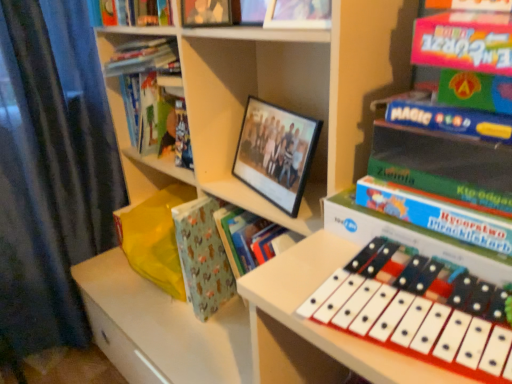
Question: Considering the relative sizes of matte black photo frame at upper center, the 3th book from the right, and black matte picture frame at center in the image provided, is matte black photo frame at upper center, the 3th book from the right, shorter than black matte picture frame at center?

Choices:
 (A) no
 (B) yes

Answer: (B)

Question: Can you confirm if matte black photo frame at upper center, the second book in the left-to-right sequence, is wider than black matte picture frame at center?

Choices:
 (A) yes
 (B) no

Answer: (B)

Question: Does matte black photo frame at upper center, the 3th book from the right, appear on the right side of black matte picture frame at center?

Choices:
 (A) yes
 (B) no

Answer: (B)

Question: From the image's perspective, would you say matte black photo frame at upper center, which ranks as the 2th book in back-to-front order, is shown under black matte picture frame at center?

Choices:
 (A) yes
 (B) no

Answer: (B)

Question: Does matte black photo frame at upper center, the 3th book from the right, have a smaller size compared to black matte picture frame at center?

Choices:
 (A) yes
 (B) no

Answer: (A)

Question: Choose the correct answer: Is green matte book at right, marked as the 1th book in a front-to-back arrangement, inside hardcover book at upper left, the 4th book from the right, or outside it?

Choices:
 (A) outside
 (B) inside

Answer: (A)

Question: From a real-world perspective, relative to hardcover book at upper left, the 4th book from the right, is green matte book at right, positioned as the first book in right-to-left order, vertically above or below?

Choices:
 (A) below
 (B) above

Answer: (B)

Question: Is point (361, 175) positioned closer to the camera than point (128, 127)?

Choices:
 (A) closer
 (B) farther

Answer: (A)

Question: Visually, is green matte book at right, the fourth book viewed from the left, positioned to the left or to the right of hardcover book at upper left, the 4th book from the right?

Choices:
 (A) left
 (B) right

Answer: (B)

Question: From the image's perspective, is matte plastic photo frame at upper center, placed as the 2th book when sorted from front to back, above or below patterned paper at center?

Choices:
 (A) above
 (B) below

Answer: (A)

Question: Based on their positions, is matte plastic photo frame at upper center, which ranks as the third book in left-to-right order, located to the left or right of patterned paper at center?

Choices:
 (A) left
 (B) right

Answer: (B)

Question: Looking at their shapes, would you say matte plastic photo frame at upper center, placed as the 2th book when sorted from front to back, is wider or thinner than patterned paper at center?

Choices:
 (A) thin
 (B) wide

Answer: (A)

Question: Relative to patterned paper at center, is matte plastic photo frame at upper center, positioned as the 2th book in right-to-left order, in front or behind?

Choices:
 (A) front
 (B) behind

Answer: (A)

Question: Visually, is matte plastic photo frame at upper center, positioned as the 2th book in right-to-left order, positioned to the left or to the right of matte black photo frame at upper center, which appears as the third book when viewed from the front?

Choices:
 (A) right
 (B) left

Answer: (A)

Question: Relative to matte black photo frame at upper center, the second book in the left-to-right sequence, is matte plastic photo frame at upper center, positioned as the 2th book in right-to-left order, in front or behind?

Choices:
 (A) behind
 (B) front

Answer: (B)